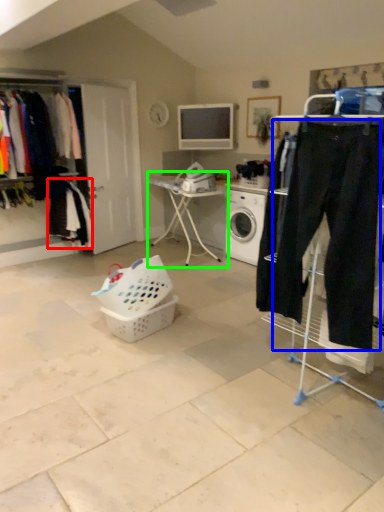
Question: Estimate the real-world distances between objects in this image. Which object is closer to clothing (highlighted by a red box), sweat pant (highlighted by a blue box) or table (highlighted by a green box)?

Choices:
 (A) sweat pant
 (B) table

Answer: (B)